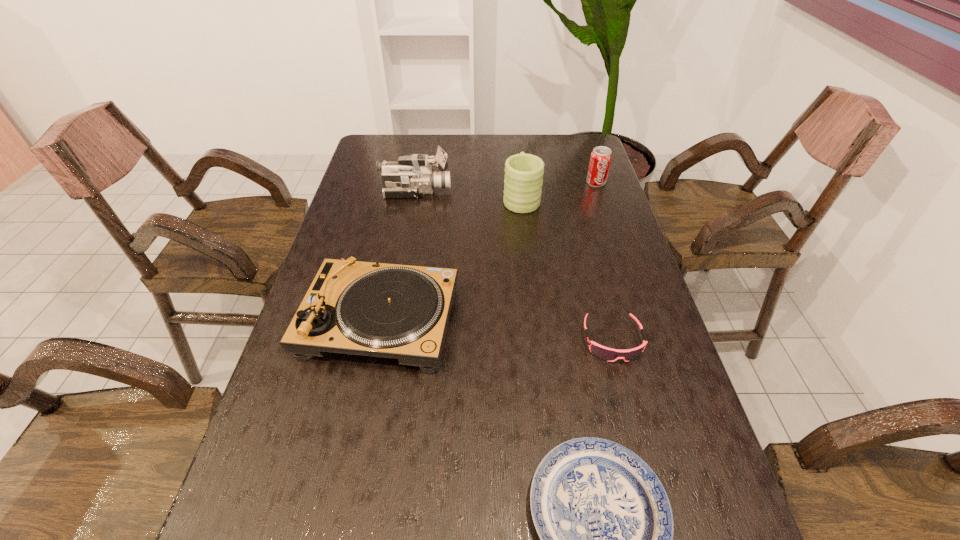
The image size is (960, 540). I want to click on vacant space located on the right of the record player, so click(539, 321).

You are a GUI agent. You are given a task and a screenshot of the screen. Output one action in this format:
    pyautogui.click(x=<x>, y=<y>)
    Task: Click on the blank space located on the front-facing side of the goggles
    The height and width of the screenshot is (540, 960).
    Given the screenshot: What is the action you would take?
    pyautogui.click(x=657, y=508)

Where is `camcorder that is at the left edge`? camcorder that is at the left edge is located at coordinates (413, 175).

Image resolution: width=960 pixels, height=540 pixels. Find the location of `record player that is at the left edge`. record player that is at the left edge is located at coordinates (395, 311).

Identify the location of soda can that is at the right edge. This screenshot has width=960, height=540. (601, 156).

Where is `goggles that is at the right edge`? This screenshot has width=960, height=540. goggles that is at the right edge is located at coordinates [608, 354].

Image resolution: width=960 pixels, height=540 pixels. I want to click on free region at the far edge of the desktop, so click(x=539, y=149).

In the image, there is a desktop. In order to click on vacant region at the left edge in this screenshot , I will do `click(318, 380)`.

Locate an element on the screen. The height and width of the screenshot is (540, 960). blank space at the right edge is located at coordinates (569, 174).

Locate an element on the screen. The image size is (960, 540). free space at the far right corner is located at coordinates (560, 159).